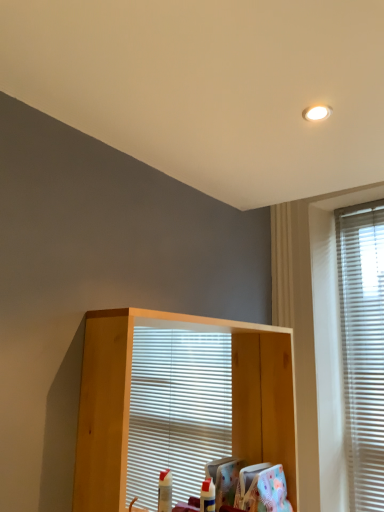
Where is `light wood shelf at center`? The height and width of the screenshot is (512, 384). light wood shelf at center is located at coordinates (130, 394).

Describe the element at coordinates (130, 394) in the screenshot. The image size is (384, 512). I see `light wood shelf at center` at that location.

The image size is (384, 512). What do you see at coordinates (330, 343) in the screenshot?
I see `white blinds at right` at bounding box center [330, 343].

You are a GUI agent. You are given a task and a screenshot of the screen. Output one action in this format:
    pyautogui.click(x=<x>, y=<y>)
    Task: Click on the white blinds at right
    The image size is (384, 512).
    Given the screenshot: What is the action you would take?
    pyautogui.click(x=330, y=343)

Find the location of a particular element. light wood shelf at center is located at coordinates (130, 394).

Does white blinds at right appear on the right side of light wood shelf at center?

Yes, white blinds at right is to the right of light wood shelf at center.

Considering their positions, is white blinds at right located in front of or behind light wood shelf at center?

Visually, white blinds at right is located behind light wood shelf at center.

Does point (325, 298) come farther from viewer compared to point (266, 426)?

Yes.

From the image's perspective, is white blinds at right located above or below light wood shelf at center?

From the image's perspective, white blinds at right appears above light wood shelf at center.

From a real-world perspective, which is physically below, white blinds at right or light wood shelf at center?

light wood shelf at center, from a real-world perspective.

Considering the sizes of objects white blinds at right and light wood shelf at center in the image provided, who is wider, white blinds at right or light wood shelf at center?

light wood shelf at center is wider.

From their relative heights in the image, would you say white blinds at right is taller or shorter than light wood shelf at center?

Clearly, white blinds at right is taller compared to light wood shelf at center.

Between white blinds at right and light wood shelf at center, which one has smaller size?

white blinds at right.

In the scene shown: Is white blinds at right located outside light wood shelf at center?

That's correct, white blinds at right is outside of light wood shelf at center.

Can you see white blinds at right touching light wood shelf at center?

No, white blinds at right is not in contact with light wood shelf at center.

Could you tell me if white blinds at right is turned towards light wood shelf at center?

No.

What's the angular difference between white blinds at right and light wood shelf at center's facing directions?

white blinds at right and light wood shelf at center are facing 89.7 degrees away from each other.

Identify the location of window positioned vertically above the light wood shelf at center (from a real-world perspective). (x=330, y=343).

Does light wood shelf at center appear on the right side of white blinds at right?

No.

Which object is more forward, light wood shelf at center or white blinds at right?

light wood shelf at center is more forward.

Considering the positions of point (265, 334) and point (308, 396), is point (265, 334) closer or farther from the camera than point (308, 396)?

Point (265, 334) is positioned closer to the camera compared to point (308, 396).

From the image's perspective, between light wood shelf at center and white blinds at right, who is located below?

light wood shelf at center appears lower in the image.

From a real-world perspective, who is located lower, light wood shelf at center or white blinds at right?

In real-world perspective, light wood shelf at center is lower.

Can you confirm if light wood shelf at center is thinner than white blinds at right?

Incorrect, the width of light wood shelf at center is not less than that of white blinds at right.

Considering the relative sizes of light wood shelf at center and white blinds at right in the image provided, is light wood shelf at center taller than white blinds at right?

No, light wood shelf at center is not taller than white blinds at right.

Does light wood shelf at center have a smaller size compared to white blinds at right?

Actually, light wood shelf at center might be larger than white blinds at right.

Would you say light wood shelf at center is outside white blinds at right?

light wood shelf at center lies outside white blinds at right's area.

Is the surface of light wood shelf at center in direct contact with white blinds at right?

light wood shelf at center is not next to white blinds at right, and they're not touching.

Is white blinds at right at the back of light wood shelf at center?

No, light wood shelf at center's orientation is not away from white blinds at right.

What's the angular difference between light wood shelf at center and white blinds at right's facing directions?

89.7 degrees separate the facing orientations of light wood shelf at center and white blinds at right.

Find the location of a particular element. Image resolution: width=384 pixels, height=512 pixels. window behind the light wood shelf at center is located at coordinates (330, 343).

Locate an element on the screen. shelf to the left of white blinds at right is located at coordinates (130, 394).

Find the location of a particular element. window that is above the light wood shelf at center (from the image's perspective) is located at coordinates (330, 343).